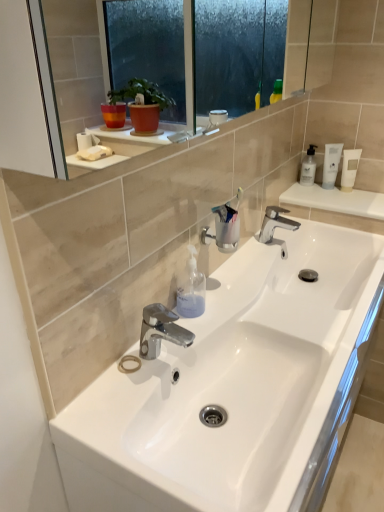
Question: Considering the positions of polished chrome faucet at center, positioned as the 2th tap in front-to-back order, and transparent plastic soap dispenser at center, marked as the 1th toiletry in a bottom-to-top arrangement, in the image, is polished chrome faucet at center, positioned as the 2th tap in front-to-back order, wider or thinner than transparent plastic soap dispenser at center, marked as the 1th toiletry in a bottom-to-top arrangement,?

Choices:
 (A) wide
 (B) thin

Answer: (A)

Question: From the image's perspective, is polished chrome faucet at center, positioned as the 1th tap in top-to-bottom order, located above or below transparent plastic soap dispenser at center, the second toiletry in the right-to-left sequence?

Choices:
 (A) above
 (B) below

Answer: (A)

Question: Which is nearer to the white plastic tube at upper right, the 2th toiletry viewed from the left?

Choices:
 (A) white matte bottle at upper right
 (B) transparent plastic soap dispenser at center, arranged as the second toiletry when viewed from the back
 (C) chrome metallic faucet at center, placed as the first tap when sorted from front to back
 (D) clear plastic cup at center
 (E) white matte tube at upper right

Answer: (E)

Question: Which of these objects is positioned farthest from the white glossy sink at center?

Choices:
 (A) white matte tube at upper right
 (B) transparent plastic soap dispenser at center, the second toiletry in the right-to-left sequence
 (C) white plastic tube at upper right, which appears as the first toiletry when viewed from the right
 (D) white matte bottle at upper right
 (E) polished chrome faucet at center, positioned as the 2th tap in front-to-back order

Answer: (D)